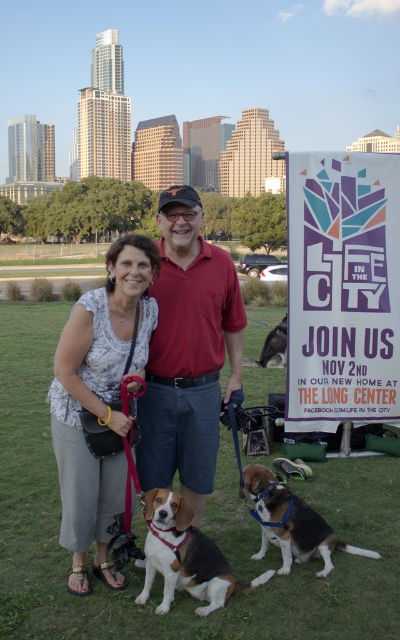
Looking at this image, does white printed blouse at center have a lesser height compared to brown fur dog at center?

No.

Is point (142, 296) closer to camera compared to point (272, 364)?

That is True.

I want to click on white printed blouse at center, so click(100, 401).

Does point (172, 598) come farther from viewer compared to point (290, 552)?

That is False.

Who is positioned more to the right, brown and white fur dog at lower center or tri-colored fur dog at center?

tri-colored fur dog at center is more to the right.

Which is behind, point (138, 595) or point (327, 570)?

Point (327, 570)

I want to click on brown and white fur dog at lower center, so click(x=182, y=554).

Identify the location of matte red shirt at center. The image size is (400, 640). (188, 353).

Can you confirm if matte red shirt at center is positioned above brown fur dog at center?

Correct, matte red shirt at center is located above brown fur dog at center.

Measure the distance between matte red shirt at center and camera.

matte red shirt at center and camera are 18.46 meters apart.

Identify the location of matte red shirt at center. (188, 353).